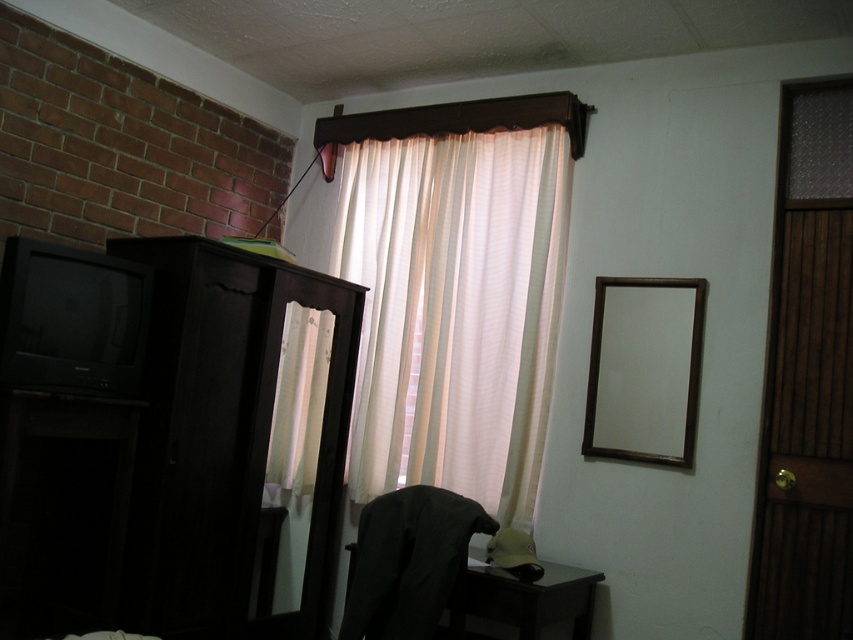
Question: Does white sheer curtain at upper center have a greater width compared to wooden frame mirror at upper right?

Choices:
 (A) no
 (B) yes

Answer: (B)

Question: Can you confirm if dark wood dresser at left is positioned above white sheer curtain at upper center?

Choices:
 (A) no
 (B) yes

Answer: (A)

Question: Which point is farther to the camera?

Choices:
 (A) white sheer curtain at upper center
 (B) dark wood dresser at left
 (C) wooden frame mirror at upper right

Answer: (A)

Question: Among these points, which one is nearest to the camera?

Choices:
 (A) (676, 392)
 (B) (107, 452)
 (C) (432, 560)

Answer: (C)

Question: Can you confirm if white sheer curtain at upper center is positioned above dark fabric chair at lower center?

Choices:
 (A) no
 (B) yes

Answer: (B)

Question: Which object is positioned farthest from the dark wood dresser at left?

Choices:
 (A) wooden frame mirror at upper right
 (B) white sheer curtain at upper center

Answer: (A)